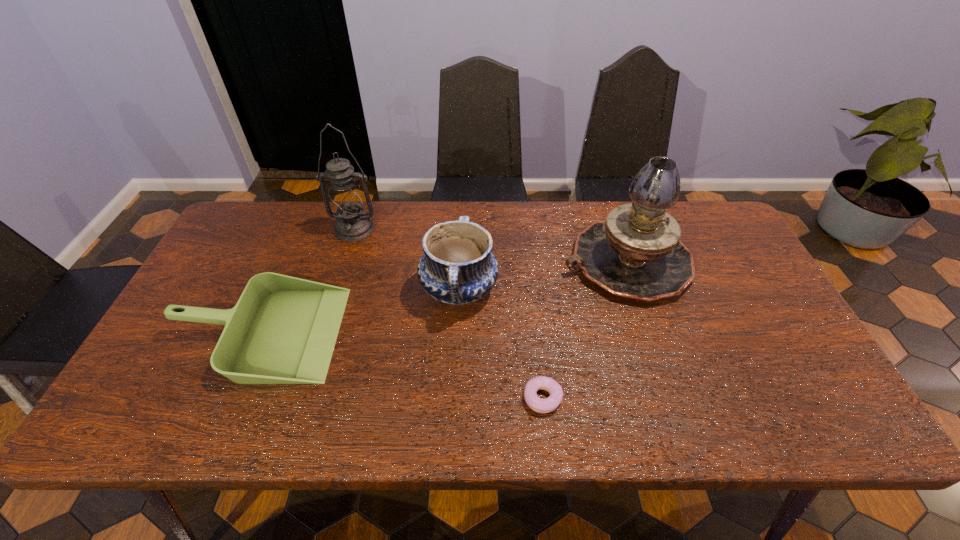
Locate an element on the screen. the left oil lamp is located at coordinates (352, 224).

You are a GUI agent. You are given a task and a screenshot of the screen. Output one action in this format:
    pyautogui.click(x=<x>, y=<y>)
    Task: Click on the rightmost object
    
    Given the screenshot: What is the action you would take?
    pyautogui.click(x=636, y=252)

Find the location of a particular element. Image resolution: width=960 pixels, height=540 pixels. the third shortest object is located at coordinates (457, 267).

Image resolution: width=960 pixels, height=540 pixels. In order to click on pottery in this screenshot , I will do `click(457, 267)`.

You are a GUI agent. You are given a task and a screenshot of the screen. Output one action in this format:
    pyautogui.click(x=<x>, y=<y>)
    Task: Click on the dustpan
    
    Given the screenshot: What is the action you would take?
    pyautogui.click(x=283, y=329)

I want to click on doughnut, so click(x=539, y=405).

You are a GUI agent. You are given a task and a screenshot of the screen. Output one action in this format:
    pyautogui.click(x=<x>, y=<y>)
    Task: Click on the shortest object
    Image resolution: width=960 pixels, height=540 pixels.
    Given the screenshot: What is the action you would take?
    pyautogui.click(x=539, y=405)

Locate an element on the screen. The width and height of the screenshot is (960, 540). vacant space located 0.110m on the right of the left oil lamp is located at coordinates (412, 229).

Where is `vacant area located on the right of the rightmost object`? This screenshot has width=960, height=540. vacant area located on the right of the rightmost object is located at coordinates (728, 262).

The width and height of the screenshot is (960, 540). What are the coordinates of `blank area located on the right of the third tallest object` in the screenshot? It's located at (588, 289).